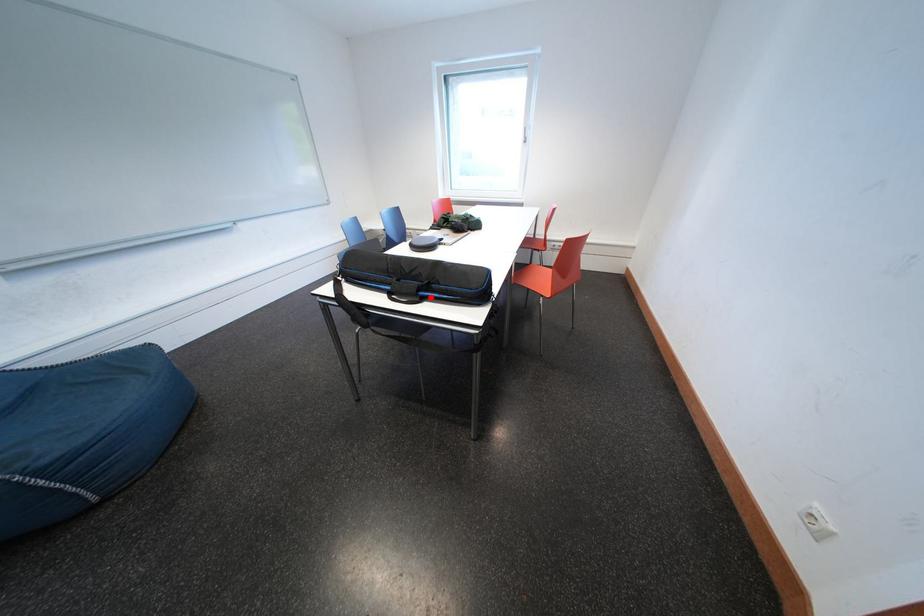
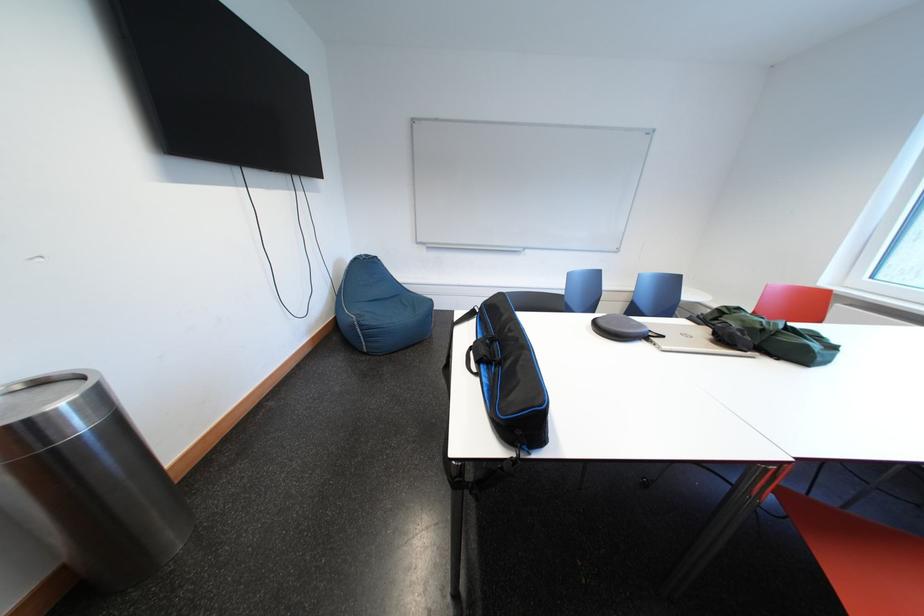
In the second image, find the point that corresponds to the highlighted location in the first image.

(492, 371)